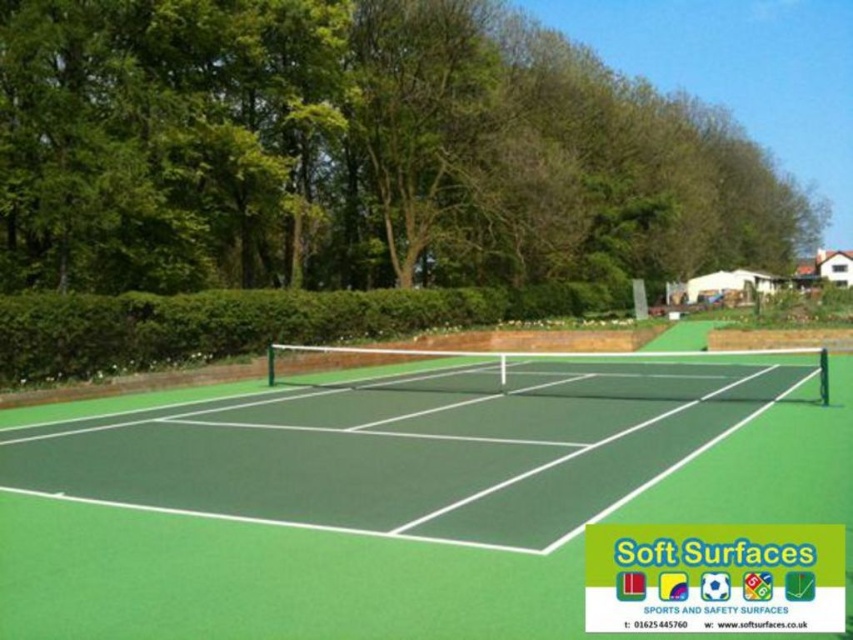
Is green leafy tree at upper center to the left of green rubber tennis court at center from the viewer's perspective?

In fact, green leafy tree at upper center is to the right of green rubber tennis court at center.

Does green leafy tree at upper center have a lesser width compared to green rubber tennis court at center?

Incorrect, green leafy tree at upper center's width is not less than green rubber tennis court at center's.

The width and height of the screenshot is (853, 640). Describe the element at coordinates (357, 152) in the screenshot. I see `green leafy tree at upper center` at that location.

The image size is (853, 640). In order to click on green leafy tree at upper center in this screenshot , I will do `click(357, 152)`.